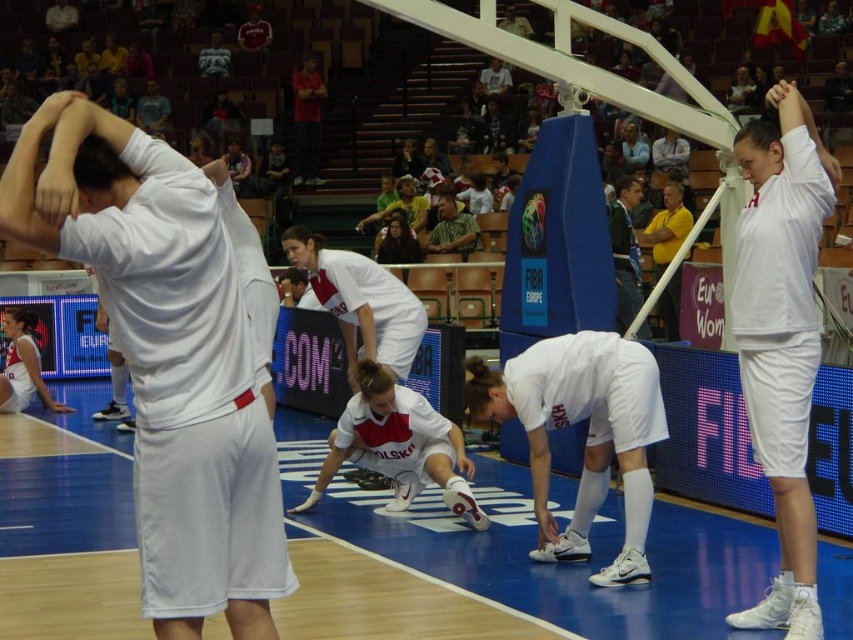
Is point (474, 564) closer to camera compared to point (437, 225)?

Yes.

What do you see at coordinates (561, 564) in the screenshot? I see `blue rubber basketball court at center` at bounding box center [561, 564].

Describe the element at coordinates (561, 564) in the screenshot. I see `blue rubber basketball court at center` at that location.

The image size is (853, 640). I want to click on blue rubber basketball court at center, so click(x=561, y=564).

What do you see at coordinates (561, 564) in the screenshot? I see `blue rubber basketball court at center` at bounding box center [561, 564].

Is point (42, 513) farther from viewer compared to point (614, 262)?

No, it is not.

At what (x,y) coordinates should I click in order to perform the action: click on blue rubber basketball court at center. Please return your answer as a coordinate pair (x, y). The image size is (853, 640). Looking at the image, I should click on (561, 564).

Locate an element on the screen. Image resolution: width=853 pixels, height=640 pixels. blue rubber basketball court at center is located at coordinates (561, 564).

Does white matte shorts at center appear on the left side of green fabric jacket at upper center?

Correct, you'll find white matte shorts at center to the left of green fabric jacket at upper center.

Locate an element on the screen. white matte shorts at center is located at coordinates (169, 362).

At what (x,y) coordinates should I click in order to perform the action: click on white matte shorts at center. Please return your answer as a coordinate pair (x, y). Image resolution: width=853 pixels, height=640 pixels. Looking at the image, I should click on [169, 362].